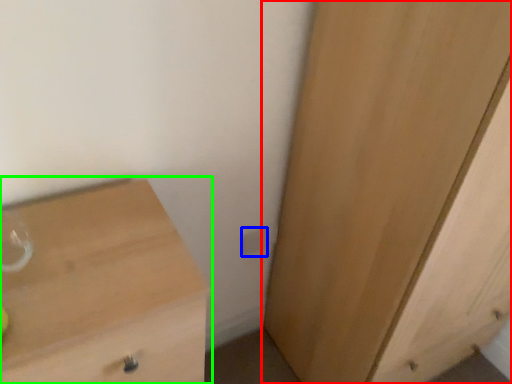
Question: Which object is positioned closest to cupboard (highlighted by a red box)? Select from electric outlet (highlighted by a blue box) and chest of drawers (highlighted by a green box).

Choices:
 (A) electric outlet
 (B) chest of drawers

Answer: (A)